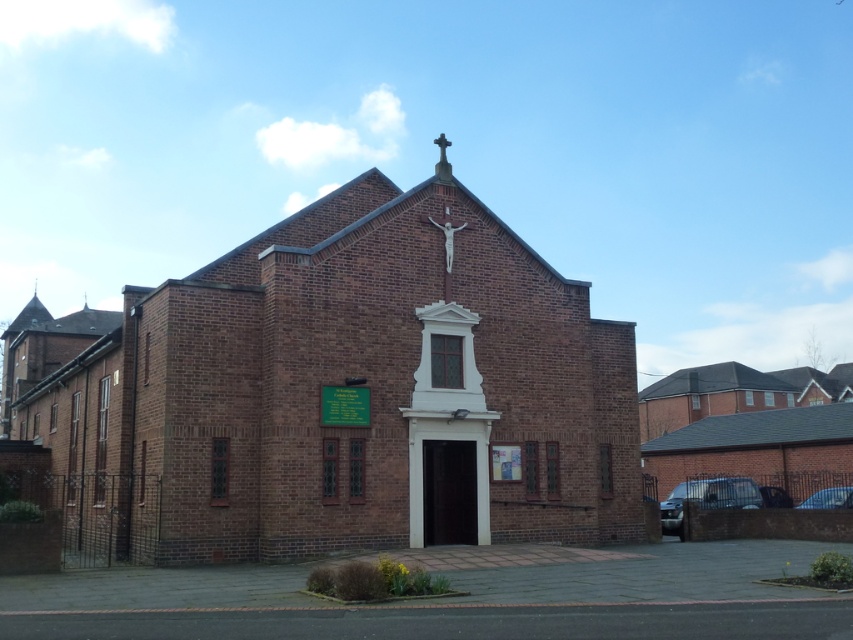
Is metallic silver car at lower right closer to the viewer compared to metallic crucifix at center?

No, it is behind metallic crucifix at center.

Where is `metallic silver car at lower right`? Image resolution: width=853 pixels, height=640 pixels. metallic silver car at lower right is located at coordinates (706, 499).

The height and width of the screenshot is (640, 853). I want to click on metallic silver car at lower right, so click(706, 499).

Can you confirm if blue metallic car at lower right is wider than metallic crucifix at center?

No, blue metallic car at lower right is not wider than metallic crucifix at center.

Is point (824, 499) more distant than point (436, 225)?

Yes, it is.

This screenshot has width=853, height=640. I want to click on blue metallic car at lower right, so [x=828, y=499].

Does point (322, 326) lie in front of point (817, 506)?

Yes.

Does brown brick church at center have a larger size compared to blue metallic car at lower right?

Indeed, brown brick church at center has a larger size compared to blue metallic car at lower right.

What do you see at coordinates (344, 388) in the screenshot?
I see `brown brick church at center` at bounding box center [344, 388].

Identify the location of brown brick church at center. (344, 388).